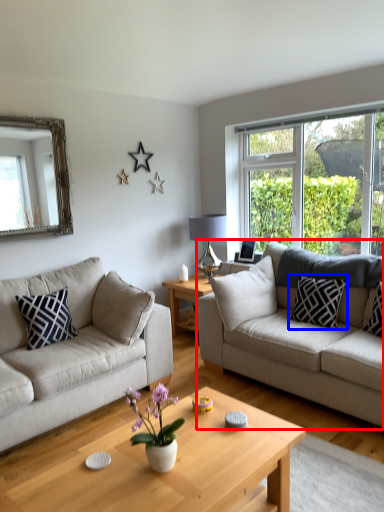
Question: Among these objects, which one is nearest to the camera, studio couch (highlighted by a red box) or pillow (highlighted by a blue box)?

Choices:
 (A) studio couch
 (B) pillow

Answer: (A)